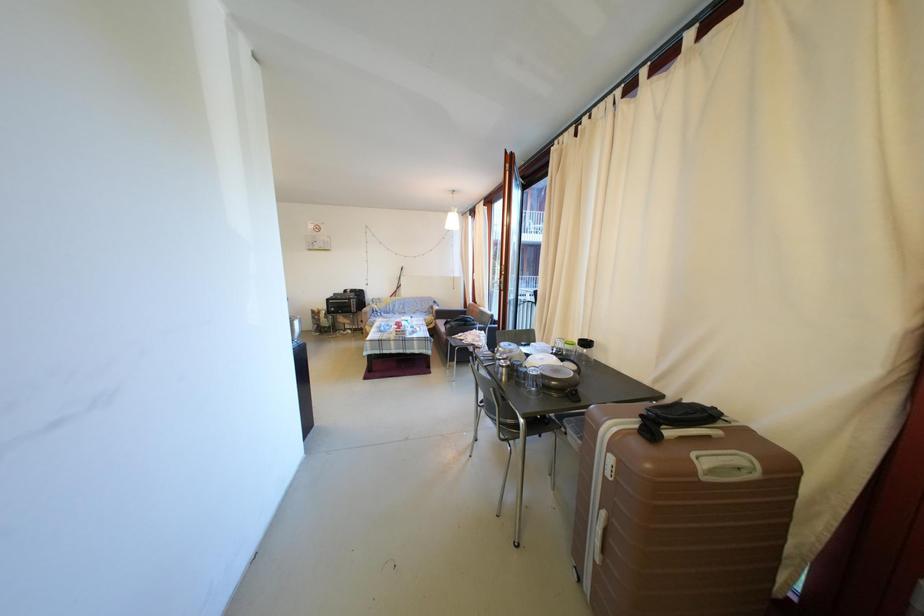
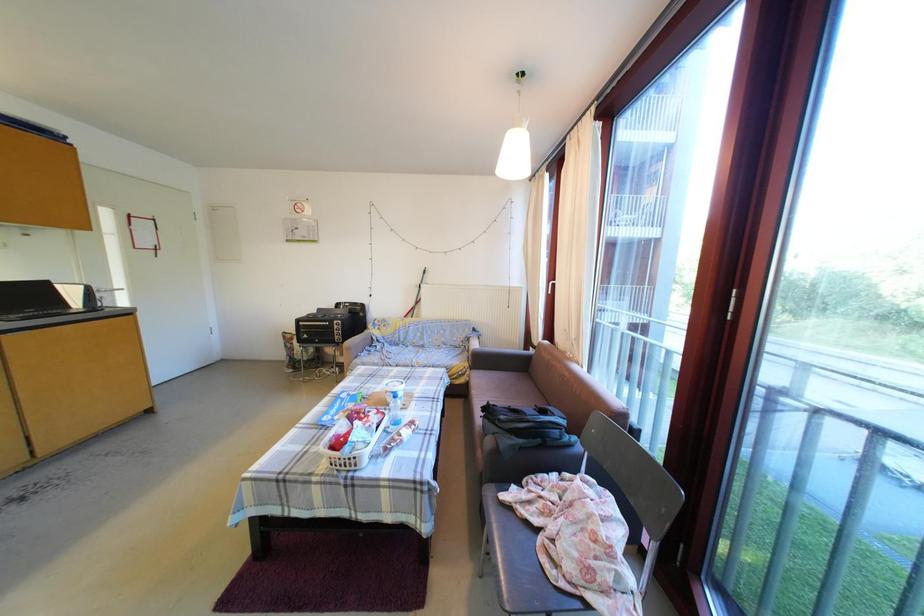
Question: The images are taken continuously from a first-person perspective. In which direction are you moving?

Choices:
 (A) Left
 (B) Right
 (C) Forward
 (D) Backward

Answer: (C)